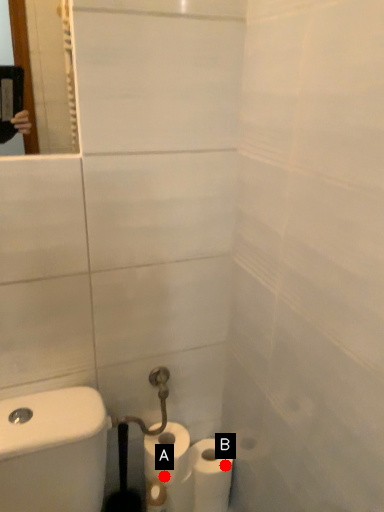
Question: Two points are circled on the image, labeled by A and B beside each circle. Among these points, which one is nearest to the camera?

Choices:
 (A) A is closer
 (B) B is closer

Answer: (A)